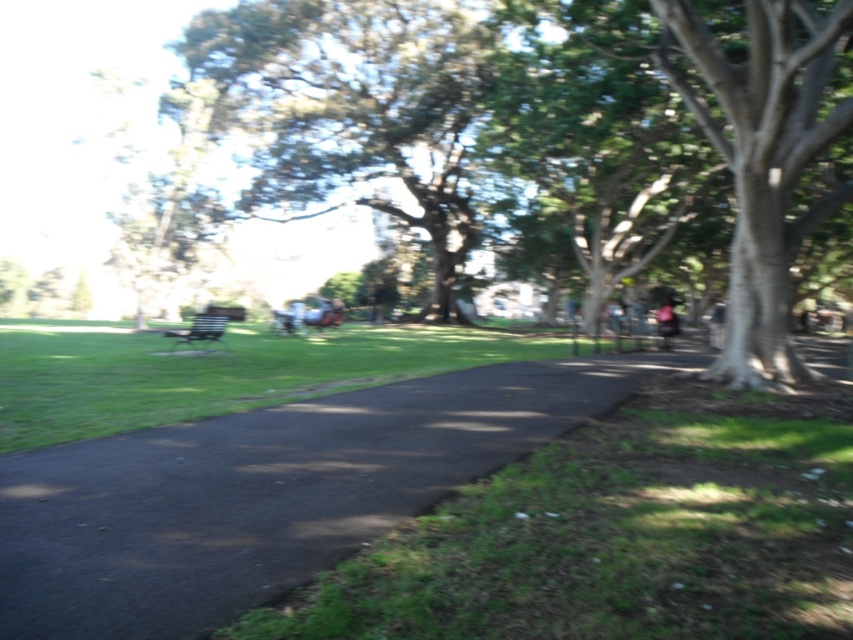
Does green grass at lower right appear on the left side of black asphalt pavement at center?

Incorrect, green grass at lower right is not on the left side of black asphalt pavement at center.

This screenshot has width=853, height=640. What do you see at coordinates (619, 536) in the screenshot?
I see `green grass at lower right` at bounding box center [619, 536].

Locate an element on the screen. The width and height of the screenshot is (853, 640). green grass at lower right is located at coordinates (619, 536).

How far apart are green grass at lower right and green leafy tree at upper center?

The distance of green grass at lower right from green leafy tree at upper center is 122.39 feet.

Is point (795, 522) farther from camera compared to point (262, 33)?

That is False.

Is point (756, 552) behind point (310, 189)?

No, it is in front of (310, 189).

Locate an element on the screen. This screenshot has height=640, width=853. green grass at lower right is located at coordinates (619, 536).

Does black asphalt pavement at center appear over dark blue fabric jacket at center-right?

No, black asphalt pavement at center is not above dark blue fabric jacket at center-right.

This screenshot has height=640, width=853. Describe the element at coordinates (260, 493) in the screenshot. I see `black asphalt pavement at center` at that location.

Is point (285, 472) positioned before point (670, 324)?

Yes, it is.

Locate an element on the screen. The image size is (853, 640). black asphalt pavement at center is located at coordinates click(260, 493).